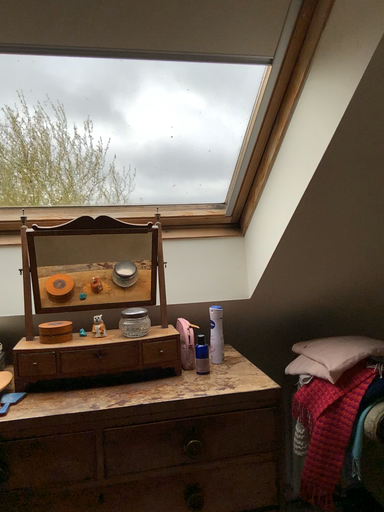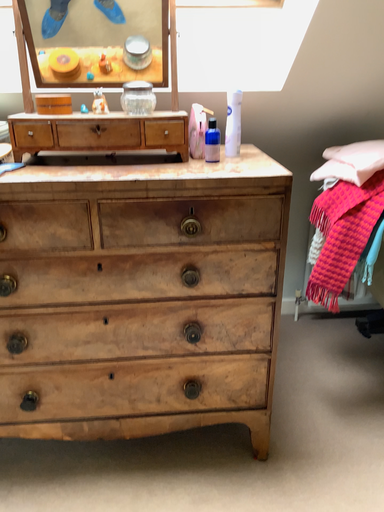
Question: How did the camera likely rotate when shooting the video?

Choices:
 (A) rotated downward
 (B) rotated upward

Answer: (A)